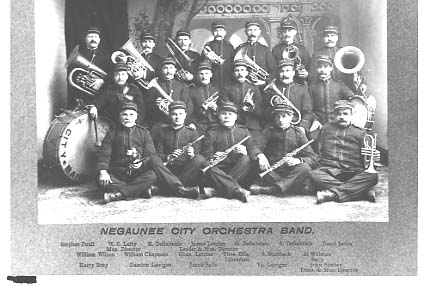
At what (x,y) coordinates should I click in order to perform the action: click on floor. Please return your answer as a coordinate pair (x, y). Looking at the image, I should click on (192, 211).